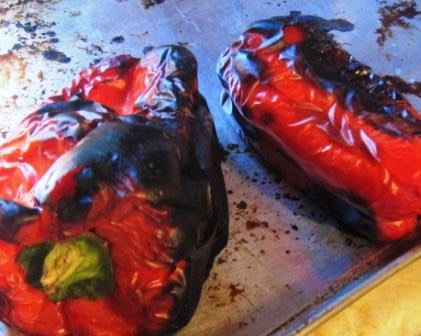
Find the location of `counter surface`. counter surface is located at coordinates (413, 310).